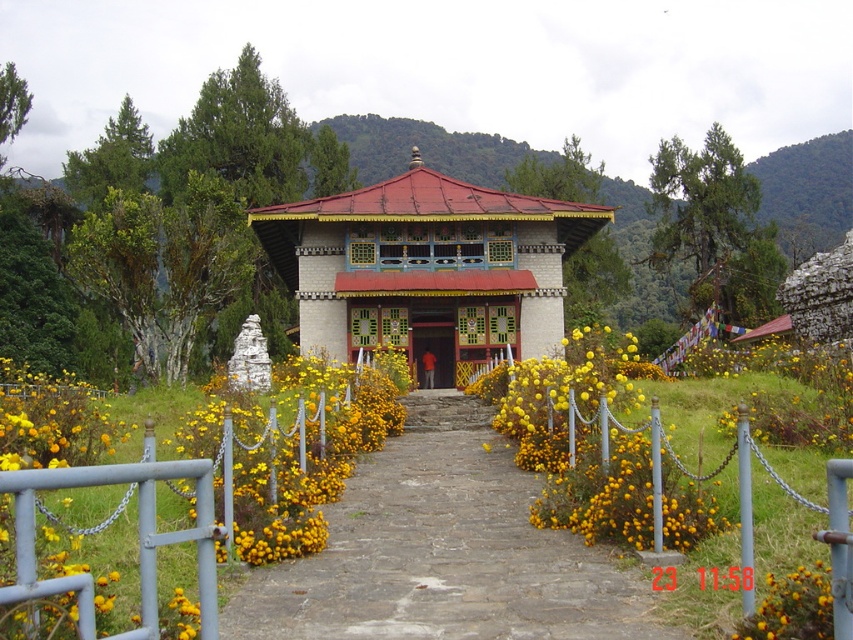
From the picture: You are standing at the entrance of the traditional building and want to take a photo of the point located at coordinate [473,516]. If your camera has a maximum zoom range of 50 feet, will you be able to capture the point clearly without moving closer?

The point at coordinate [473,516] is 56.61 feet away from your current position. Since your camera can only zoom up to 50 feet, you will need to move closer to capture the point clearly.

You are planning to place a new bench in the garden. The bench is 1.2 meters wide. You see the matte white gazebo at center and the yellow matte flower at center. Which object can the bench fit next to without overlapping?

The bench can fit next to the matte white gazebo at center because it might be wider than the yellow matte flower at center, providing enough space.

You are planning to host a small gathering in the area shown. Given the presence of the matte white gazebo at center and the matte wooden door at center, which object would be more suitable for setting up a table and chairs to accommodate your guests?

The matte white gazebo at center is bigger than the matte wooden door at center, so it would be more suitable for setting up a table and chairs to accommodate guests.